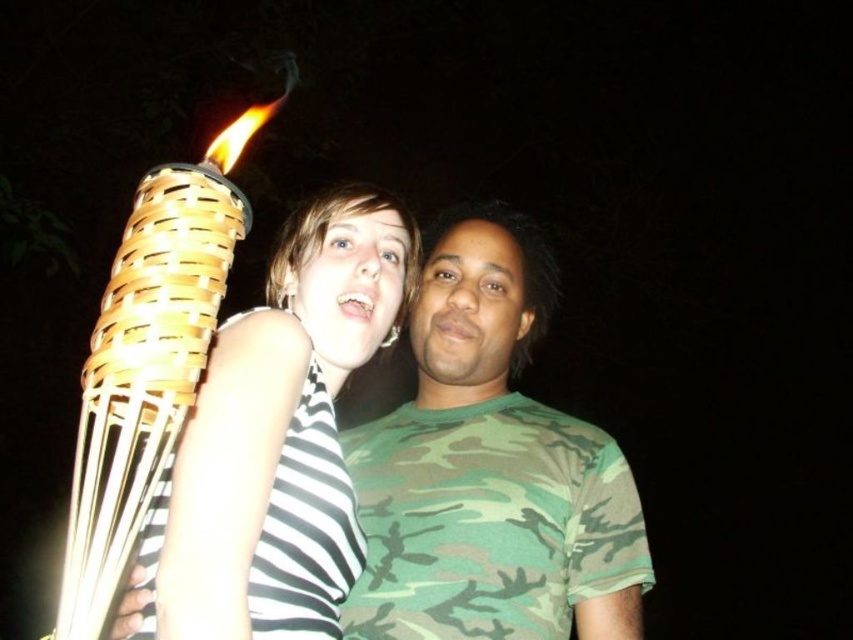
You are a photographer setting up a night shoot. You need to position a light source to illuminate the camouflage fabric shirt at center and the matte woven torch at left. Based on their positions in the image, which object should you place the light closer to to ensure both are well lit?

The camouflage fabric shirt at center is located below the matte woven torch at left, so placing the light closer to the camouflage fabric shirt at center would ensure both receive adequate illumination.

You are a photographer setting up a night shoot. You have a camouflage fabric shirt at center and a matte woven torch at left in your scene. Which object should you adjust to ensure proper lighting since one is much taller than the other?

The camouflage fabric shirt at center is much taller than the matte woven torch at left, so you should adjust the position of the camouflage fabric shirt at center to ensure proper lighting.

You are a photographer setting up a night scene with two torches. You have a matte woven torch at left and a woven bamboo torch at left. Which torch should you choose if you want the taller one to be the main light source?

The matte woven torch at left is taller than the woven bamboo torch at left, so you should choose the matte woven torch at left as the main light source since it is taller and can provide more illumination.